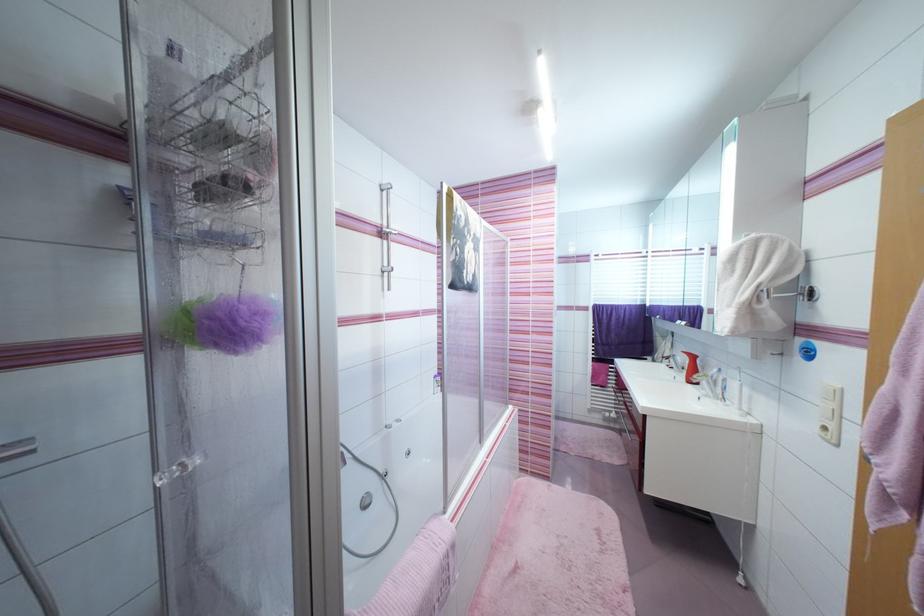
The height and width of the screenshot is (616, 924). Find the location of `red dispenser`. red dispenser is located at coordinates (687, 351).